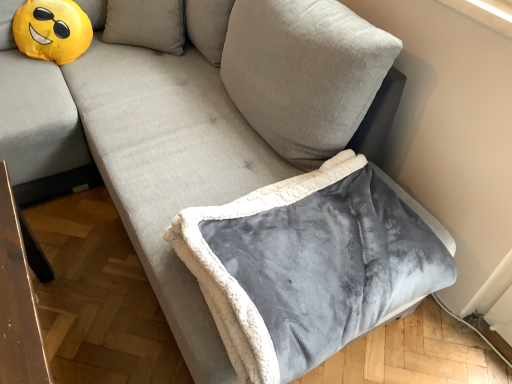
What do you see at coordinates (308, 265) in the screenshot? Image resolution: width=512 pixels, height=384 pixels. I see `gray fleece blanket at lower right` at bounding box center [308, 265].

Find the location of `gray fleece blanket at lower right`. gray fleece blanket at lower right is located at coordinates coord(308,265).

Measure the distance between point (315, 353) and camera.

The distance of point (315, 353) from camera is 38.27 inches.

In order to face gray fleece blanket at lower right, should I rotate leftwards or rightwards?

Turn right approximately 8.200 degrees to face it.

Identify the location of gray fleece blanket at lower right. (308, 265).